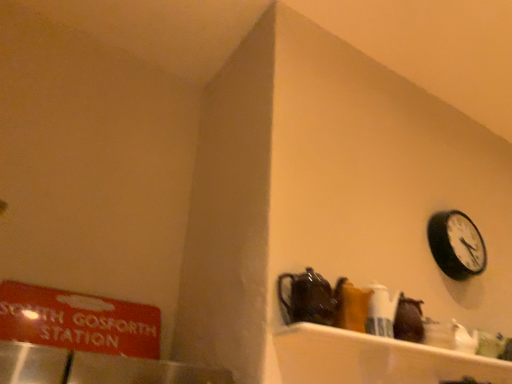
Question: Can you confirm if black matte wall clock at upper right is bigger than shiny dark brown teapot at center?

Choices:
 (A) yes
 (B) no

Answer: (A)

Question: Is the depth of black matte wall clock at upper right greater than that of shiny dark brown teapot at center?

Choices:
 (A) no
 (B) yes

Answer: (B)

Question: Is black matte wall clock at upper right looking in the opposite direction of shiny dark brown teapot at center?

Choices:
 (A) yes
 (B) no

Answer: (B)

Question: Could you tell me if black matte wall clock at upper right is facing shiny dark brown teapot at center?

Choices:
 (A) no
 (B) yes

Answer: (A)

Question: From a real-world perspective, is black matte wall clock at upper right located beneath shiny dark brown teapot at center?

Choices:
 (A) yes
 (B) no

Answer: (B)

Question: Is black matte wall clock at upper right taller than shiny dark brown teapot at center?

Choices:
 (A) yes
 (B) no

Answer: (A)

Question: From the image's perspective, is red matte sign at left located above shiny dark brown teapot at center?

Choices:
 (A) no
 (B) yes

Answer: (A)

Question: Is red matte sign at left oriented away from shiny dark brown teapot at center?

Choices:
 (A) no
 (B) yes

Answer: (A)

Question: Is red matte sign at left facing towards shiny dark brown teapot at center?

Choices:
 (A) no
 (B) yes

Answer: (B)

Question: From a real-world perspective, is red matte sign at left located beneath shiny dark brown teapot at center?

Choices:
 (A) no
 (B) yes

Answer: (B)

Question: Can you confirm if red matte sign at left is shorter than shiny dark brown teapot at center?

Choices:
 (A) yes
 (B) no

Answer: (B)

Question: Considering the relative sizes of red matte sign at left and shiny dark brown teapot at center in the image provided, is red matte sign at left thinner than shiny dark brown teapot at center?

Choices:
 (A) yes
 (B) no

Answer: (A)

Question: Is shiny dark brown teapot at center positioned behind red matte sign at left?

Choices:
 (A) no
 (B) yes

Answer: (A)